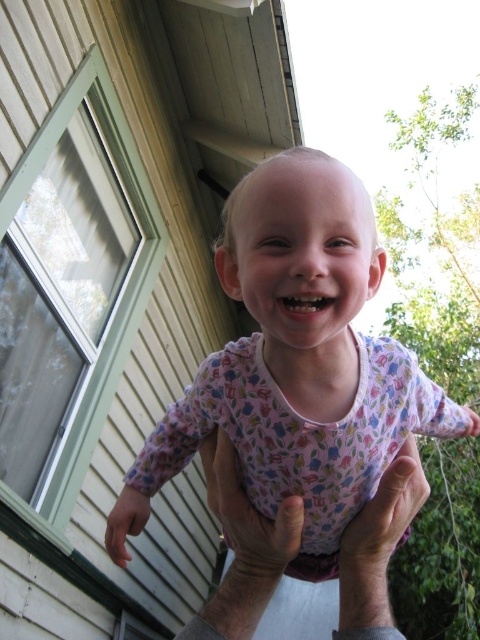
From the picture: Between pink floral pajamas at center and skinny white hands at lower center, which one is positioned higher?

pink floral pajamas at center is higher up.

Is point (249, 448) closer to camera compared to point (278, 509)?

No, (249, 448) is behind (278, 509).

Between point (385, 456) and point (216, 492), which one is positioned behind?

The point (385, 456) is more distant.

Find the location of a particular element. The width and height of the screenshot is (480, 640). pink floral pajamas at center is located at coordinates (296, 358).